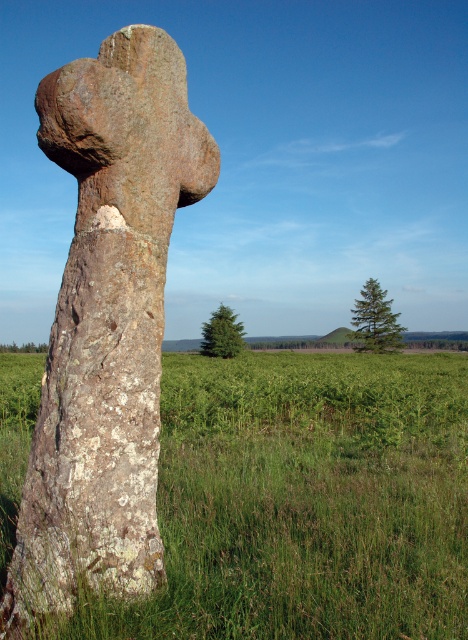
Can you confirm if green grassy at center is thinner than lichen-covered stone cross at center?

In fact, green grassy at center might be wider than lichen-covered stone cross at center.

Can you confirm if green grassy at center is positioned to the left of lichen-covered stone cross at center?

Indeed, green grassy at center is positioned on the left side of lichen-covered stone cross at center.

Does point (320, 403) come in front of point (36, 604)?

That is False.

In order to click on green grassy at center in this screenshot , I will do click(x=304, y=502).